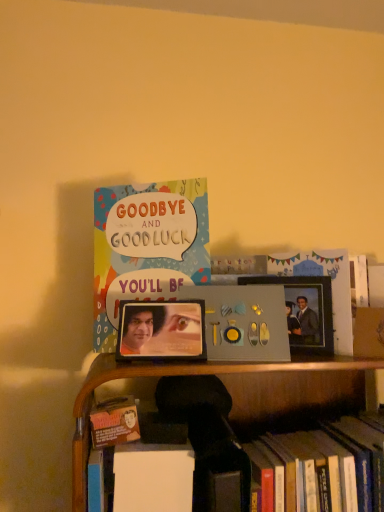
This screenshot has height=512, width=384. Describe the element at coordinates (162, 330) in the screenshot. I see `metallic photo frame at center, the 2th picture frame in the back-to-front sequence` at that location.

I want to click on hardcover book at lower right, the first book positioned from the bottom, so click(x=249, y=471).

Find the location of a particular element. The width and height of the screenshot is (384, 512). multicolored paper card at upper center, positioned as the 1th book in top-to-bottom order is located at coordinates (147, 244).

Identify the location of metallic photo frame at center, which is the second picture frame in right-to-left order. This screenshot has height=512, width=384. (162, 330).

Can you confirm if metallic photo frame at center, which is the second picture frame in right-to-left order, is taller than hardcover book at lower right, the 2th book when ordered from top to bottom?

Incorrect, the height of metallic photo frame at center, which is the second picture frame in right-to-left order, is not larger of that of hardcover book at lower right, the 2th book when ordered from top to bottom.

From a real-world perspective, is metallic photo frame at center, which is the second picture frame in right-to-left order, physically located above or below hardcover book at lower right, the 2th book when ordered from top to bottom?

metallic photo frame at center, which is the second picture frame in right-to-left order, is above hardcover book at lower right, the 2th book when ordered from top to bottom.

Considering the points (149, 344) and (351, 426), which point is in front, point (149, 344) or point (351, 426)?

The point (149, 344) is closer to the camera.

From the image's perspective, which one is positioned higher, metallic photo frame at center, which ranks as the 1th picture frame in front-to-back order, or hardcover book at lower right, the 2th book when ordered from top to bottom?

metallic photo frame at center, which ranks as the 1th picture frame in front-to-back order.

Considering the sizes of objects multicolored paper card at upper center, which is counted as the 2th book, starting from the right, and hardcover book at lower right, which is the 2th book from left to right, in the image provided, who is wider, multicolored paper card at upper center, which is counted as the 2th book, starting from the right, or hardcover book at lower right, which is the 2th book from left to right,?

With larger width is hardcover book at lower right, which is the 2th book from left to right.

Considering the relative positions of multicolored paper card at upper center, acting as the second book starting from the bottom, and hardcover book at lower right, the 2th book when ordered from top to bottom, in the image provided, is multicolored paper card at upper center, acting as the second book starting from the bottom, to the left of hardcover book at lower right, the 2th book when ordered from top to bottom, from the viewer's perspective?

Correct, you'll find multicolored paper card at upper center, acting as the second book starting from the bottom, to the left of hardcover book at lower right, the 2th book when ordered from top to bottom.

From a real-world perspective, which object rests below the other?

In real-world perspective, hardcover book at lower right, which is the 1th book from right to left, is lower.

Is multicolored paper card at upper center, marked as the 1th book in a left-to-right arrangement, not close to hardcover book at lower right, which is the 2th book from left to right?

No, multicolored paper card at upper center, marked as the 1th book in a left-to-right arrangement, is in close proximity to hardcover book at lower right, which is the 2th book from left to right.

In the scene shown: From a real-world perspective, who is located higher, hardcover book at lower right, the first book positioned from the bottom, or metallic photo frame at center, which is the second picture frame in right-to-left order?

metallic photo frame at center, which is the second picture frame in right-to-left order, from a real-world perspective.

Does hardcover book at lower right, which is the 1th book from right to left, have a greater width compared to metallic photo frame at center, which is the second picture frame in right-to-left order?

Yes, hardcover book at lower right, which is the 1th book from right to left, is wider than metallic photo frame at center, which is the second picture frame in right-to-left order.

Is hardcover book at lower right, which is the 2th book from left to right, bigger or smaller than metallic photo frame at center, marked as the first picture frame in a left-to-right arrangement?

In the image, hardcover book at lower right, which is the 2th book from left to right, appears to be larger than metallic photo frame at center, marked as the first picture frame in a left-to-right arrangement.

Are metallic photo frame at center, which ranks as the 1th picture frame in front-to-back order, and multicolored paper card at upper center, positioned as the 1th book in top-to-bottom order, located far from each other?

Actually, metallic photo frame at center, which ranks as the 1th picture frame in front-to-back order, and multicolored paper card at upper center, positioned as the 1th book in top-to-bottom order, are a little close together.

From the image's perspective, is metallic photo frame at center, which ranks as the 1th picture frame in front-to-back order, under multicolored paper card at upper center, positioned as the 1th book in top-to-bottom order?

Yes, from the image's perspective, metallic photo frame at center, which ranks as the 1th picture frame in front-to-back order, is beneath multicolored paper card at upper center, positioned as the 1th book in top-to-bottom order.

Which is in front, point (121, 304) or point (161, 247)?

The point (161, 247) is closer to the camera.

Considering the relative positions of hardcover book at lower right, which is the 2th book from left to right, and multicolored paper card at upper center, which is counted as the 2th book, starting from the right, in the image provided, is hardcover book at lower right, which is the 2th book from left to right, in front of multicolored paper card at upper center, which is counted as the 2th book, starting from the right,?

Yes, hardcover book at lower right, which is the 2th book from left to right, is closer to the camera.

Does hardcover book at lower right, the 2th book when ordered from top to bottom, have a greater height compared to multicolored paper card at upper center, positioned as the 1th book in top-to-bottom order?

No.

Are metallic silver photo frame at right, which is the second picture frame in front-to-back order, and multicolored paper card at upper center, marked as the 1th book in a left-to-right arrangement, beside each other?

No, metallic silver photo frame at right, which is the second picture frame in front-to-back order, is not next to multicolored paper card at upper center, marked as the 1th book in a left-to-right arrangement.

Based on the photo, from a real-world perspective, who is located higher, metallic silver photo frame at right, which is the second picture frame in front-to-back order, or multicolored paper card at upper center, positioned as the 1th book in top-to-bottom order?

multicolored paper card at upper center, positioned as the 1th book in top-to-bottom order, from a real-world perspective.

Is metallic silver photo frame at right, which is the second picture frame in front-to-back order, positioned with its back to multicolored paper card at upper center, marked as the 1th book in a left-to-right arrangement?

No, metallic silver photo frame at right, which is the second picture frame in front-to-back order, is not facing the opposite direction of multicolored paper card at upper center, marked as the 1th book in a left-to-right arrangement.

Image resolution: width=384 pixels, height=512 pixels. Find the location of `the 2nd picture frame to the right of the multicolored paper card at upper center, acting as the second book starting from the bottom, starting your count from the anchor`. the 2nd picture frame to the right of the multicolored paper card at upper center, acting as the second book starting from the bottom, starting your count from the anchor is located at coordinates (304, 310).

Which object is wider, multicolored paper card at upper center, which is counted as the 2th book, starting from the right, or metallic silver photo frame at right, the first picture frame from the right?

multicolored paper card at upper center, which is counted as the 2th book, starting from the right, is wider.

Based on the photo, based on their positions, is multicolored paper card at upper center, positioned as the 1th book in top-to-bottom order, located to the left or right of metallic silver photo frame at right, positioned as the 1th picture frame in back-to-front order?

From the image, it's evident that multicolored paper card at upper center, positioned as the 1th book in top-to-bottom order, is to the left of metallic silver photo frame at right, positioned as the 1th picture frame in back-to-front order.

From the image's perspective, which object appears higher, multicolored paper card at upper center, marked as the 1th book in a left-to-right arrangement, or metallic silver photo frame at right, positioned as the 1th picture frame in back-to-front order?

multicolored paper card at upper center, marked as the 1th book in a left-to-right arrangement, appears higher in the image.

You are a GUI agent. You are given a task and a screenshot of the screen. Output one action in this format:
    pyautogui.click(x=<x>, y=<y>)
    Task: Click on the book on the right of metallic photo frame at center, which ranks as the 1th picture frame in front-to-back order
    This screenshot has height=512, width=384.
    Given the screenshot: What is the action you would take?
    pyautogui.click(x=249, y=471)

The width and height of the screenshot is (384, 512). In order to click on book that is above the hardcover book at lower right, the 2th book when ordered from top to bottom (from the image's perspective) in this screenshot , I will do `click(147, 244)`.

From the image, which object appears to be farther from multicolored paper card at upper center, acting as the second book starting from the bottom, hardcover book at lower right, the first book positioned from the bottom, or metallic silver photo frame at right, the first picture frame from the right?

Among the two, hardcover book at lower right, the first book positioned from the bottom, is located further to multicolored paper card at upper center, acting as the second book starting from the bottom.

Which object lies further to the anchor point multicolored paper card at upper center, positioned as the 1th book in top-to-bottom order, metallic silver photo frame at right, marked as the second picture frame in a left-to-right arrangement, or metallic photo frame at center, which is the second picture frame in right-to-left order?

metallic silver photo frame at right, marked as the second picture frame in a left-to-right arrangement, is further to multicolored paper card at upper center, positioned as the 1th book in top-to-bottom order.

From the image, which object appears to be farther from metallic silver photo frame at right, marked as the second picture frame in a left-to-right arrangement, hardcover book at lower right, which is the 1th book from right to left, or multicolored paper card at upper center, acting as the second book starting from the bottom?

Among the two, multicolored paper card at upper center, acting as the second book starting from the bottom, is located further to metallic silver photo frame at right, marked as the second picture frame in a left-to-right arrangement.

Looking at the image, which one is located further to metallic photo frame at center, which is the second picture frame in right-to-left order, hardcover book at lower right, the first book positioned from the bottom, or multicolored paper card at upper center, positioned as the 1th book in top-to-bottom order?

The object further to metallic photo frame at center, which is the second picture frame in right-to-left order, is hardcover book at lower right, the first book positioned from the bottom.

Estimate the real-world distances between objects in this image. Which object is further from metallic silver photo frame at right, marked as the second picture frame in a left-to-right arrangement, hardcover book at lower right, which is the 2th book from left to right, or metallic photo frame at center, the 2th picture frame in the back-to-front sequence?

The object further to metallic silver photo frame at right, marked as the second picture frame in a left-to-right arrangement, is hardcover book at lower right, which is the 2th book from left to right.

Which object lies further to the anchor point multicolored paper card at upper center, marked as the 1th book in a left-to-right arrangement, metallic photo frame at center, which ranks as the 1th picture frame in front-to-back order, or metallic silver photo frame at right, marked as the second picture frame in a left-to-right arrangement?

metallic silver photo frame at right, marked as the second picture frame in a left-to-right arrangement.

From the image, which object appears to be nearer to hardcover book at lower right, which is the 1th book from right to left, metallic silver photo frame at right, the first picture frame from the right, or metallic photo frame at center, which is the second picture frame in right-to-left order?

metallic photo frame at center, which is the second picture frame in right-to-left order.

Estimate the real-world distances between objects in this image. Which object is closer to metallic photo frame at center, marked as the first picture frame in a left-to-right arrangement, multicolored paper card at upper center, acting as the second book starting from the bottom, or hardcover book at lower right, the 2th book when ordered from top to bottom?

multicolored paper card at upper center, acting as the second book starting from the bottom, is closer to metallic photo frame at center, marked as the first picture frame in a left-to-right arrangement.

I want to click on picture frame that lies between metallic silver photo frame at right, which is the second picture frame in front-to-back order, and hardcover book at lower right, the 2th book when ordered from top to bottom, from top to bottom, so click(162, 330).

Where is `picture frame between multicolored paper card at upper center, positioned as the 1th book in top-to-bottom order, and metallic silver photo frame at right, positioned as the 1th picture frame in back-to-front order`? picture frame between multicolored paper card at upper center, positioned as the 1th book in top-to-bottom order, and metallic silver photo frame at right, positioned as the 1th picture frame in back-to-front order is located at coordinates (162, 330).